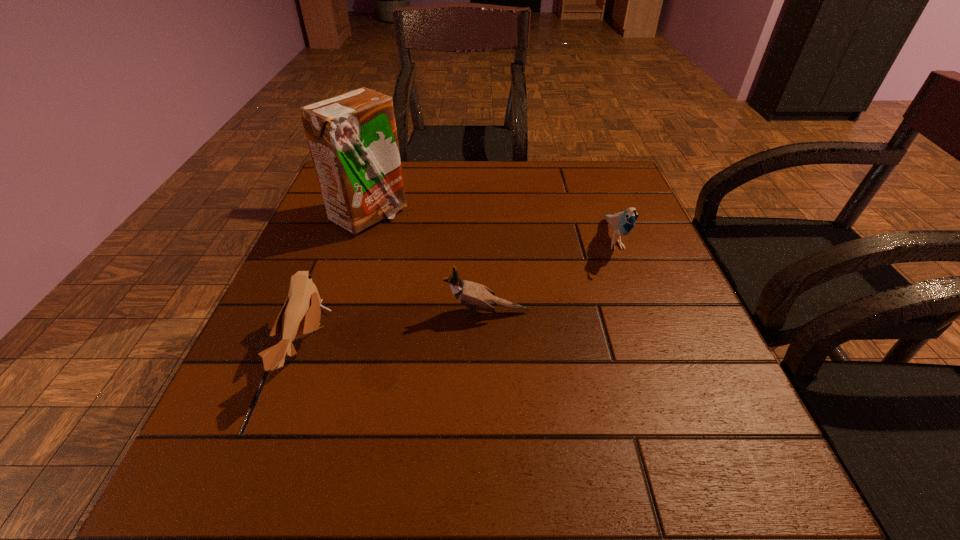
In order to click on free space at the near right corner in this screenshot , I will do `click(733, 492)`.

Identify the location of empty space between the rightmost bird and the carton. This screenshot has height=540, width=960. (492, 228).

What are the coordinates of `free spot between the second bird from right to left and the tallest object` in the screenshot? It's located at (427, 265).

Where is `free space between the third object from left to right and the rightmost object`? The image size is (960, 540). free space between the third object from left to right and the rightmost object is located at coordinates (550, 276).

The height and width of the screenshot is (540, 960). What are the coordinates of `vacant region between the second bird from right to left and the rightmost bird` in the screenshot? It's located at (550, 276).

This screenshot has width=960, height=540. What are the coordinates of `vacant space that is in between the leftmost bird and the tallest object` in the screenshot? It's located at tap(337, 282).

Where is `free space between the farthest bird and the third object from left to right`? This screenshot has width=960, height=540. free space between the farthest bird and the third object from left to right is located at coordinates click(x=550, y=276).

The width and height of the screenshot is (960, 540). What are the coordinates of `free space between the rightmost object and the second bird from right to left` in the screenshot? It's located at (550, 276).

Image resolution: width=960 pixels, height=540 pixels. Identify the location of unoccupied position between the rightmost object and the carton. (492, 228).

Where is `vacant area between the leftmost bird and the second bird from right to left`? vacant area between the leftmost bird and the second bird from right to left is located at coordinates (396, 329).